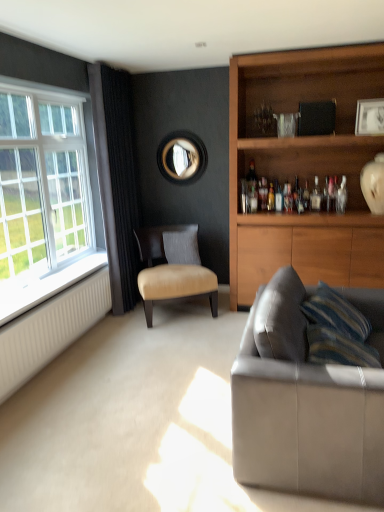
Measure the distance between point (294, 201) and camera.

Point (294, 201) is 3.95 meters away from camera.

This screenshot has width=384, height=512. What do you see at coordinates (182, 157) in the screenshot? I see `matte black circular mirror at upper center` at bounding box center [182, 157].

In order to click on white plastic window at left in this screenshot , I will do (45, 196).

Identify the location of translucent glass bottle at shelf center, the first bottle positioned from the back. (298, 197).

From a real-world perspective, which object rests below the other?

leather at center.

Does point (152, 251) come behind point (197, 236)?

No, (152, 251) is in front of (197, 236).

Is leather at center completely or partially outside of suede gray pillow at center?

Absolutely, leather at center is external to suede gray pillow at center.

Does leather at center turn towards suede gray pillow at center?

Yes, leather at center is turned towards suede gray pillow at center.

Between clear glass bottle at upper right, the second bottle when ordered from left to right, and matte black circular mirror at upper center, which one appears on the right side from the viewer's perspective?

From the viewer's perspective, clear glass bottle at upper right, the second bottle when ordered from left to right, appears more on the right side.

From the image's perspective, which is above, clear glass bottle at upper right, which is counted as the first bottle, starting from the right, or matte black circular mirror at upper center?

matte black circular mirror at upper center is shown above in the image.

Who is bigger, clear glass bottle at upper right, placed as the 2th bottle when sorted from back to front, or matte black circular mirror at upper center?

matte black circular mirror at upper center.

Is clear glass bottle at upper right, which is the 1th bottle from front to back, next to matte black circular mirror at upper center?

clear glass bottle at upper right, which is the 1th bottle from front to back, and matte black circular mirror at upper center are clearly separated.

Is clear glass bottle at upper right, placed as the 2th bottle when sorted from back to front, facing towards leather at center?

No, clear glass bottle at upper right, placed as the 2th bottle when sorted from back to front, is not facing towards leather at center.

From the image's perspective, which one is positioned higher, clear glass bottle at upper right, which is the 1th bottle from front to back, or leather at center?

clear glass bottle at upper right, which is the 1th bottle from front to back, from the image's perspective.

Considering the sizes of objects clear glass bottle at upper right, placed as the 2th bottle when sorted from back to front, and leather at center in the image provided, who is thinner, clear glass bottle at upper right, placed as the 2th bottle when sorted from back to front, or leather at center?

clear glass bottle at upper right, placed as the 2th bottle when sorted from back to front.

In the scene shown: Is clear glass bottle at upper right, which is counted as the first bottle, starting from the right, situated inside leather at center or outside?

clear glass bottle at upper right, which is counted as the first bottle, starting from the right, lies outside leather at center.

Considering the sizes of objects clear glass bottle at upper right, the second bottle when ordered from left to right, and white painted wood at left in the image provided, who is thinner, clear glass bottle at upper right, the second bottle when ordered from left to right, or white painted wood at left?

clear glass bottle at upper right, the second bottle when ordered from left to right.

From the image's perspective, which is above, clear glass bottle at upper right, the second bottle when ordered from left to right, or white painted wood at left?

clear glass bottle at upper right, the second bottle when ordered from left to right, from the image's perspective.

Does point (343, 196) come in front of point (20, 296)?

No, (343, 196) is further to viewer.

Considering the relative sizes of clear glass bottle at upper right, the second bottle when ordered from left to right, and white painted wood at left in the image provided, is clear glass bottle at upper right, the second bottle when ordered from left to right, smaller than white painted wood at left?

Indeed, clear glass bottle at upper right, the second bottle when ordered from left to right, has a smaller size compared to white painted wood at left.

Is white painted wood at left taller or shorter than matte black circular mirror at upper center?

In the image, white painted wood at left appears to be shorter than matte black circular mirror at upper center.

Does point (40, 301) come farther from viewer compared to point (201, 168)?

No.

From the image's perspective, is white painted wood at left on top of matte black circular mirror at upper center?

No, from the image's perspective, white painted wood at left is not over matte black circular mirror at upper center.

From the image's perspective, is white ribbed radiator at lower left on top of white plastic window at left?

No, from the image's perspective, white ribbed radiator at lower left is not over white plastic window at left.

Is white ribbed radiator at lower left placed right next to white plastic window at left?

Answer: white ribbed radiator at lower left and white plastic window at left are not in contact.

Considering the positions of point (25, 348) and point (85, 142), is point (25, 348) closer or farther from the camera than point (85, 142)?

Point (25, 348) appears to be closer to the viewer than point (85, 142).

Which is more to the left, white painted wood at left or white ribbed radiator at lower left?

white painted wood at left is more to the left.

Between white painted wood at left and white ribbed radiator at lower left, which one has larger width?

With larger width is white painted wood at left.

Is white painted wood at left taller than white ribbed radiator at lower left?

Incorrect, the height of white painted wood at left is not larger of that of white ribbed radiator at lower left.

You are a GUI agent. You are given a task and a screenshot of the screen. Output one action in this format:
    pyautogui.click(x=<x>, y=<y>)
    Task: Click on the chair in front of the suede gray pillow at center
    
    Given the screenshot: What is the action you would take?
    pyautogui.click(x=172, y=271)

You are a GUI agent. You are given a task and a screenshot of the screen. Output one action in this format:
    pyautogui.click(x=<x>, y=<y>)
    Task: Click on the mirror located on the left of clear glass bottle at upper right, the second bottle when ordered from left to right
    The height and width of the screenshot is (512, 384).
    Given the screenshot: What is the action you would take?
    pyautogui.click(x=182, y=157)

Which object lies nearer to the anchor point white painted wood at left, leather couch at lower right or matte black circular mirror at upper center?

matte black circular mirror at upper center lies closer to white painted wood at left than the other object.

Based on their spatial positions, is leather at center or leather couch at lower right closer to suede gray pillow at center?

Based on the image, leather at center appears to be nearer to suede gray pillow at center.

Looking at the image, which one is located closer to black velvet curtain at left, leather at center or matte black circular mirror at upper center?

The object closer to black velvet curtain at left is leather at center.

Estimate the real-world distances between objects in this image. Which object is further from matte black circular mirror at upper center, suede gray pillow at center or translucent glass bottle at shelf center, acting as the 2th bottle starting from the front?

translucent glass bottle at shelf center, acting as the 2th bottle starting from the front, is positioned further to the anchor matte black circular mirror at upper center.

Which object lies nearer to the anchor point white plastic window at left, clear glass bottle at upper right, placed as the 2th bottle when sorted from back to front, or matte black circular mirror at upper center?

The object closer to white plastic window at left is matte black circular mirror at upper center.

Considering their positions, is leather at center positioned closer to white plastic window at left than leather couch at lower right?

leather at center lies closer to white plastic window at left than the other object.

Looking at the image, which one is located closer to white ribbed radiator at lower left, white plastic window at left or white painted wood at left?

white painted wood at left is positioned closer to the anchor white ribbed radiator at lower left.

When comparing their distances from matte black circular mirror at upper center, does leather at center or translucent glass bottle at shelf center, the first bottle positioned from the back, seem further?

translucent glass bottle at shelf center, the first bottle positioned from the back.

You are a GUI agent. You are given a task and a screenshot of the screen. Output one action in this format:
    pyautogui.click(x=<x>, y=<y>)
    Task: Click on the pillow located between matte black circular mirror at upper center and clear glass bottle at upper right, the second bottle when ordered from left to right, in the left-right direction
    
    Given the screenshot: What is the action you would take?
    pyautogui.click(x=182, y=245)

This screenshot has width=384, height=512. Find the location of `window between leather couch at lower right and suede gray pillow at center from front to back`. window between leather couch at lower right and suede gray pillow at center from front to back is located at coordinates (45, 196).

Find the location of a particular element. The height and width of the screenshot is (512, 384). window sill between white plastic window at left and matte black circular mirror at upper center along the z-axis is located at coordinates (47, 285).

Where is `curtain between white plastic window at left and leather couch at lower right`? curtain between white plastic window at left and leather couch at lower right is located at coordinates (117, 180).